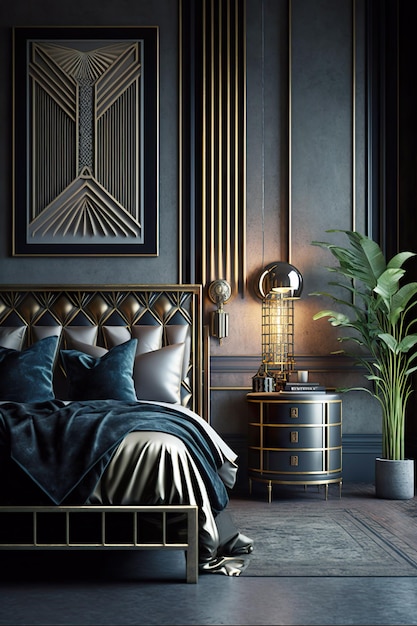
I want to click on wall art, so click(x=90, y=140).